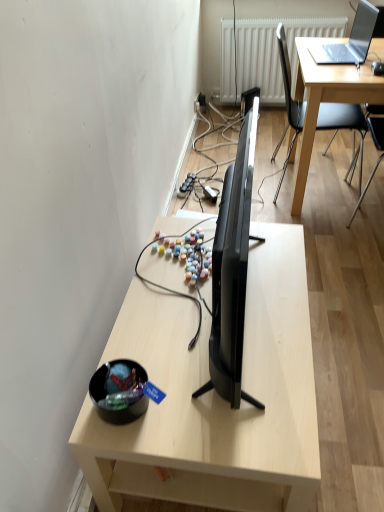
This screenshot has height=512, width=384. Find the location of `vacant space behind shiny black bowl at lower left`. vacant space behind shiny black bowl at lower left is located at coordinates (158, 324).